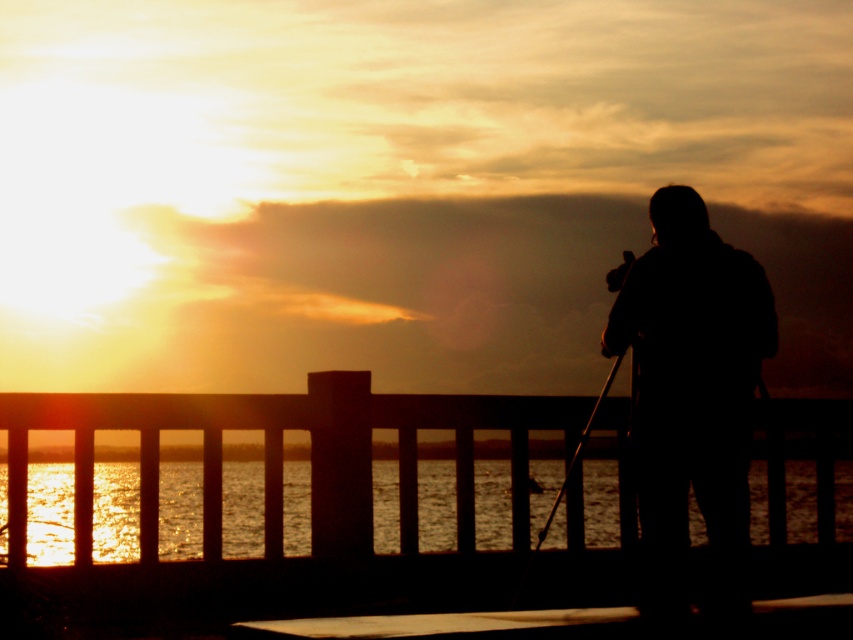
Question: Which object is positioned farthest from the metallic tripod at right?

Choices:
 (A) glistening water at lower center
 (B) smooth wooden dock at lower center
 (C) silhouette figure at right

Answer: (A)

Question: Which point is farther from the camera taking this photo?

Choices:
 (A) (683, 310)
 (B) (569, 470)

Answer: (B)

Question: In this image, where is silhouette figure at right located relative to glistening water at lower center?

Choices:
 (A) left
 (B) right

Answer: (B)

Question: Can you confirm if silhouette figure at right is thinner than glistening water at lower center?

Choices:
 (A) yes
 (B) no

Answer: (A)

Question: Which of the following is the farthest from the observer?

Choices:
 (A) metallic tripod at right
 (B) smooth wooden dock at lower center
 (C) silhouette figure at right
 (D) glistening water at lower center

Answer: (D)

Question: Is smooth wooden dock at lower center to the right of metallic tripod at right from the viewer's perspective?

Choices:
 (A) no
 (B) yes

Answer: (B)